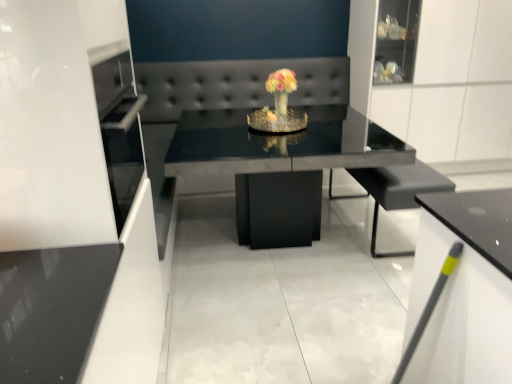
Question: From a real-world perspective, is black matte armchair at center over black leather couch at center?

Choices:
 (A) yes
 (B) no

Answer: (B)

Question: Is black matte armchair at center closer to camera compared to black leather couch at center?

Choices:
 (A) yes
 (B) no

Answer: (A)

Question: Does black matte armchair at center appear on the right side of black leather couch at center?

Choices:
 (A) yes
 (B) no

Answer: (A)

Question: From the image's perspective, would you say black matte armchair at center is positioned over black leather couch at center?

Choices:
 (A) no
 (B) yes

Answer: (A)

Question: Is black matte armchair at center wider than black leather couch at center?

Choices:
 (A) no
 (B) yes

Answer: (A)

Question: Considering the relative sizes of black matte armchair at center and black leather couch at center in the image provided, is black matte armchair at center shorter than black leather couch at center?

Choices:
 (A) no
 (B) yes

Answer: (B)

Question: Can you confirm if white glossy cabinet at lower right is thinner than glossy black table at center?

Choices:
 (A) no
 (B) yes

Answer: (B)

Question: Does white glossy cabinet at lower right appear on the right side of glossy black table at center?

Choices:
 (A) yes
 (B) no

Answer: (A)

Question: Is white glossy cabinet at lower right located outside glossy black table at center?

Choices:
 (A) no
 (B) yes

Answer: (B)

Question: Could glossy black table at center be considered to be inside white glossy cabinet at lower right?

Choices:
 (A) yes
 (B) no

Answer: (B)

Question: Does white glossy cabinet at lower right have a lesser height compared to glossy black table at center?

Choices:
 (A) yes
 (B) no

Answer: (B)

Question: Is the depth of white glossy cabinet at lower right less than that of glossy black table at center?

Choices:
 (A) yes
 (B) no

Answer: (A)

Question: Can you confirm if black matte armchair at center is positioned to the left of glossy black table at center?

Choices:
 (A) yes
 (B) no

Answer: (B)